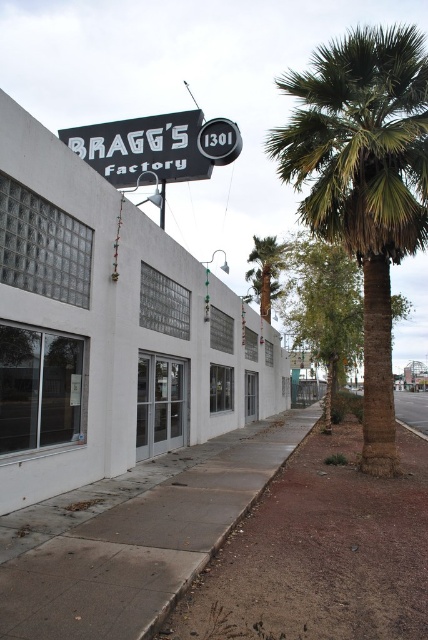
Question: Estimate the real-world distances between objects in this image. Which object is farther from the green leafy palm tree at right?

Choices:
 (A) gray concrete sidewalk at lower center
 (B) black plastic sign at upper center

Answer: (B)

Question: Among these points, which one is farthest from the camera?

Choices:
 (A) (171, 141)
 (B) (264, 508)
 (C) (32, 556)
 (D) (261, 307)

Answer: (D)

Question: Can you confirm if white matte building at center is smaller than dirt/rough pavement at lower center?

Choices:
 (A) no
 (B) yes

Answer: (A)

Question: Which is nearer to the dirt/rough pavement at lower center?

Choices:
 (A) white matte building at center
 (B) black plastic sign at upper center

Answer: (A)

Question: Is gray concrete sidewalk at lower center in front of green leafy palm tree at center?

Choices:
 (A) yes
 (B) no

Answer: (A)

Question: Is the position of white matte building at center more distant than that of black plastic sign at upper center?

Choices:
 (A) yes
 (B) no

Answer: (B)